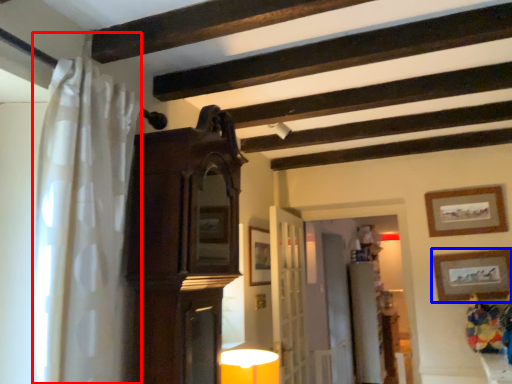
Question: Among these objects, which one is nearest to the camera, shower curtain (highlighted by a red box) or picture frame (highlighted by a blue box)?

Choices:
 (A) shower curtain
 (B) picture frame

Answer: (A)